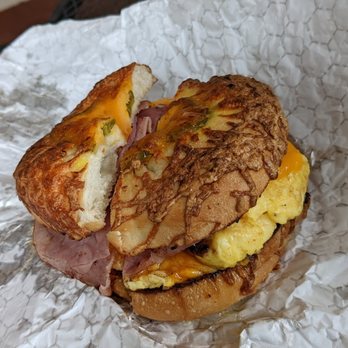
Locate an element on the screen. This screenshot has height=348, width=348. light wall background is located at coordinates tap(3, 6).